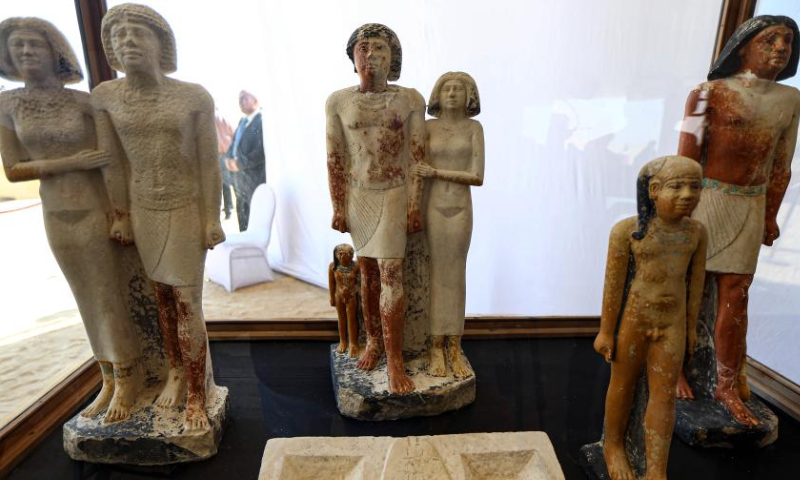
Where is `white chair or sofa in center behind display`? This screenshot has width=800, height=480. white chair or sofa in center behind display is located at coordinates (245, 261).